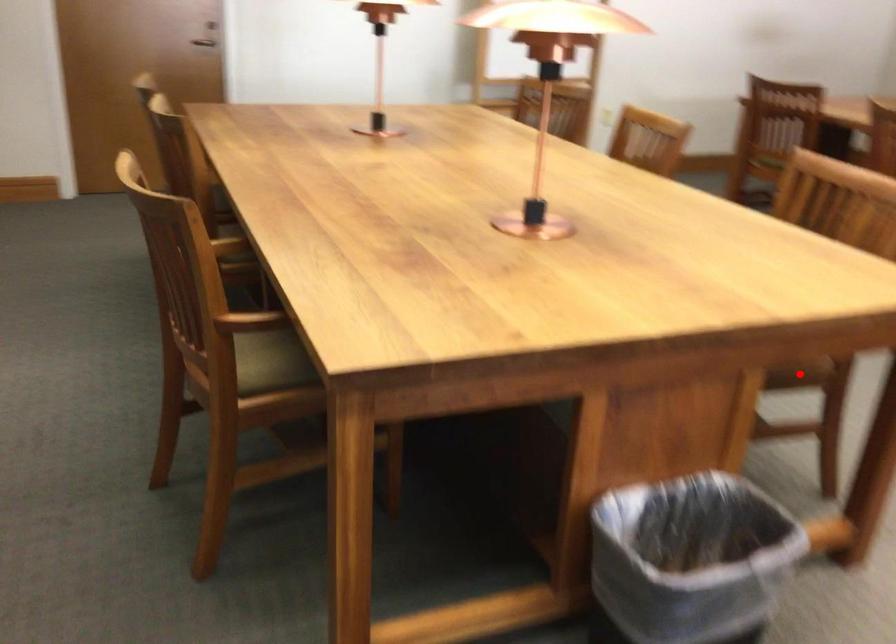
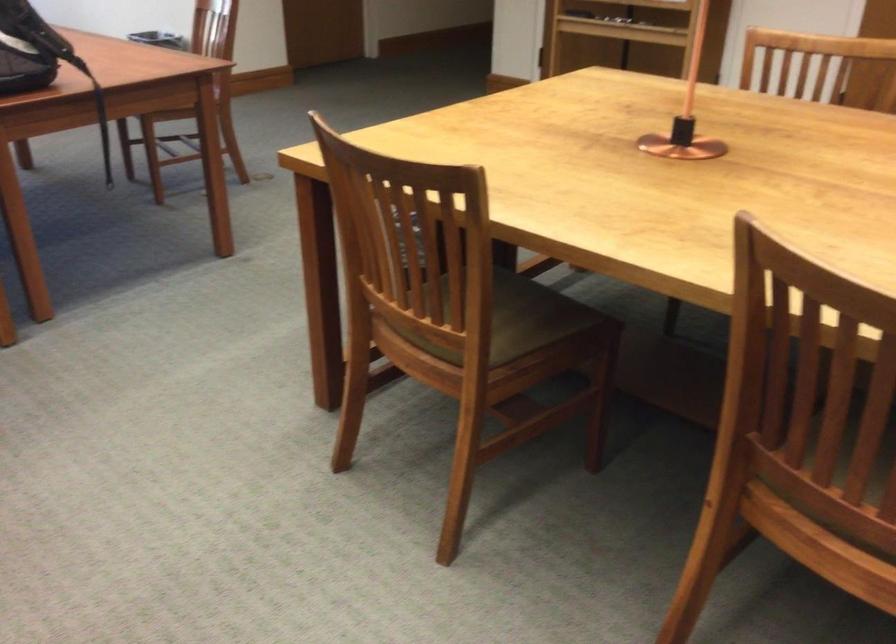
Question: I am providing you with two images of the same scene from different viewpoints. A red point is marked on the first image. Can you still see the location of the red point in image 2?

Choices:
 (A) Yes
 (B) No

Answer: (B)